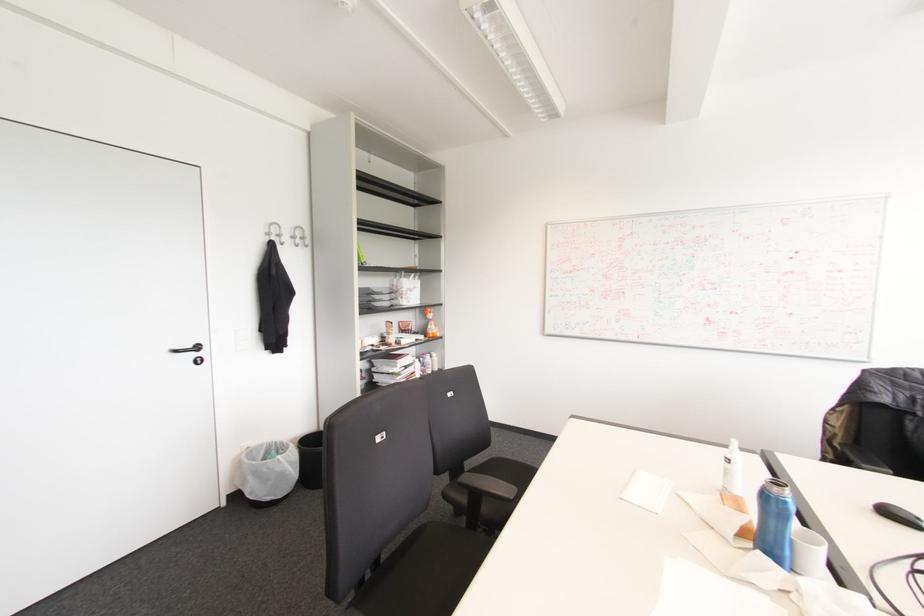
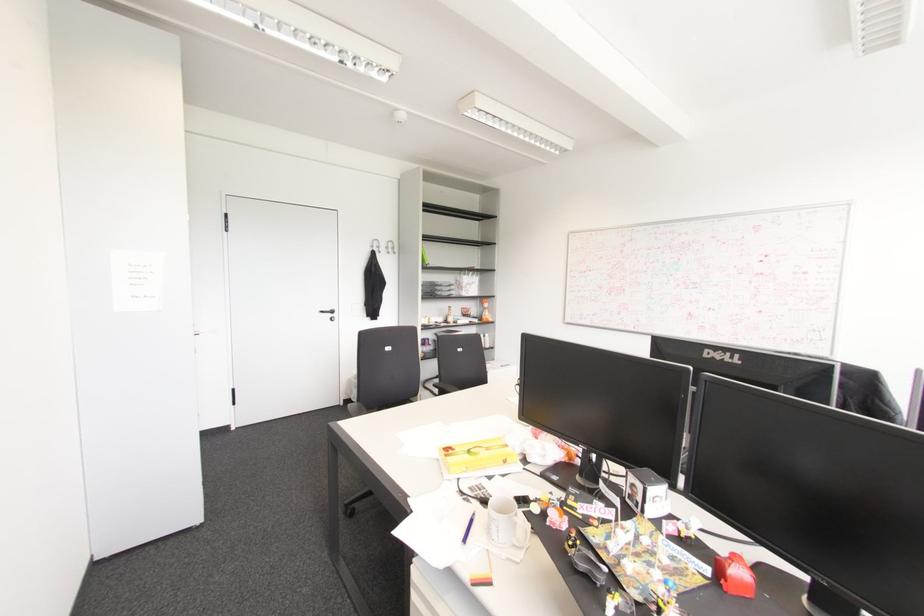
Where in the second image is the point corresponding to point (197, 347) from the first image?

(332, 310)